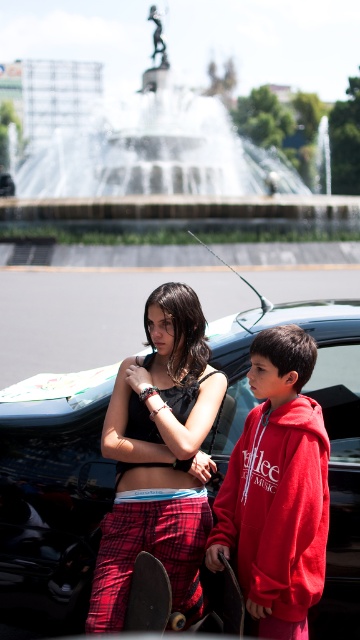
You are standing in the park and see the white marble fountain at center and the black matte skateboard at lower left. Which object is positioned higher relative to the other?

The white marble fountain at center is located above the black matte skateboard at lower left, so it is positioned higher.

You are trying to take a photo of the shiny black car at center without any obstructions. Is the black matte skateboard at lower left blocking your view of the car?

The black matte skateboard at lower left is behind the shiny black car at center, so it does not block the view of the car.